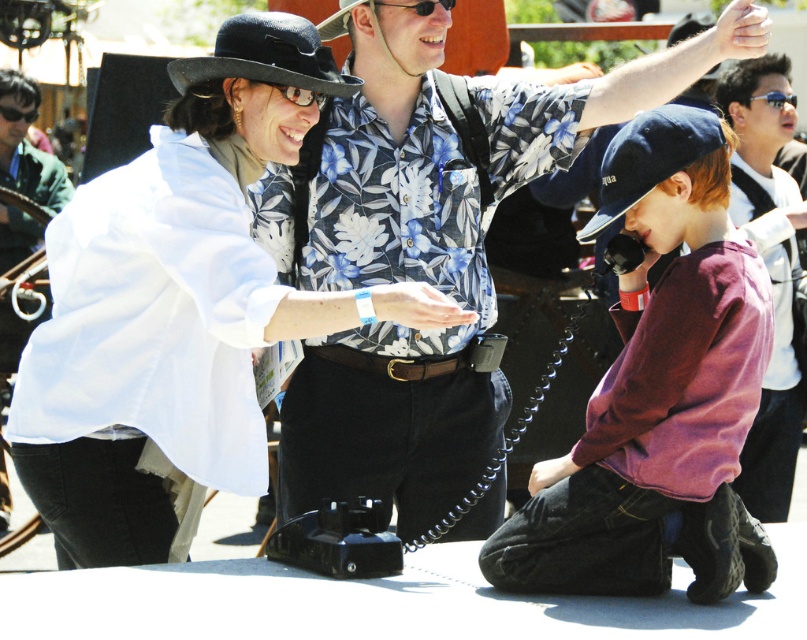
What object is located at the coordinate point (300, 96) in the image?

The clear plastic goggles at center is located at the coordinate point (300, 96).

You are a photographer positioned at the center of the scene. You want to take a photo that includes both the purple cotton shirt at lower right and the white matte shirt at left. Which shirt should you adjust your camera angle to focus on first to ensure both are in frame?

Since the purple cotton shirt at lower right is closer to the viewer than the white matte shirt at left, you should focus on the purple cotton shirt at lower right first. This ensures that adjusting the camera angle to include the farther white matte shirt at left will keep both in frame.